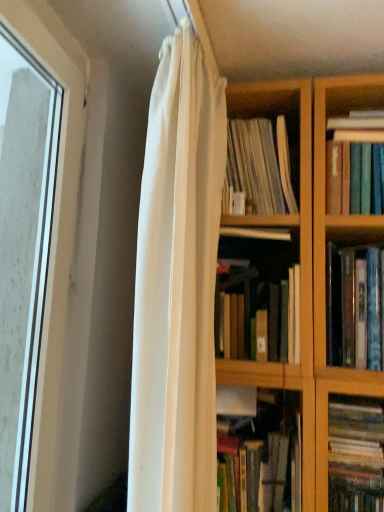
Measure the distance between hardcover book at center, the 2th book ordered from the bottom, and camera.

The depth of hardcover book at center, the 2th book ordered from the bottom, is 3.45 feet.

Measure the distance between point [348,414] and camera.

The depth of point [348,414] is 1.04 meters.

At what (x,y) coordinates should I click in order to perform the action: click on hardcover book at upper right, the 1th book viewed from the top. Please return your answer as a coordinate pair (x, y). This screenshot has height=512, width=384. Looking at the image, I should click on (356, 163).

The height and width of the screenshot is (512, 384). What do you see at coordinates (54, 220) in the screenshot? I see `clear glass window at left` at bounding box center [54, 220].

At what (x,y) coordinates should I click in order to perform the action: click on hardcover book at center, the 2th book ordered from the bottom. Please return your answer as a coordinate pair (x, y). Looking at the image, I should click on (266, 320).

Consider the image. Is hardcover book at upper right, acting as the fifth book starting from the bottom, located outside white paper at center, the fourth book when ordered from bottom to top?

Yes, hardcover book at upper right, acting as the fifth book starting from the bottom, is not within white paper at center, the fourth book when ordered from bottom to top.

Locate an element on the screen. The image size is (384, 512). the 1st book directly beneath the hardcover book at upper right, acting as the fifth book starting from the bottom (from a real-world perspective) is located at coordinates (259, 166).

Is hardcover book at upper right, acting as the fifth book starting from the bottom, next to white paper at center, the fourth book when ordered from bottom to top?

No, hardcover book at upper right, acting as the fifth book starting from the bottom, is not with white paper at center, the fourth book when ordered from bottom to top.

From the image's perspective, who appears lower, white sheer curtain at center or clear glass window at left?

white sheer curtain at center.

From a real-world perspective, is white sheer curtain at center physically located above or below clear glass window at left?

In terms of real-world spatial position, white sheer curtain at center is above clear glass window at left.

Measure the distance between white sheer curtain at center and clear glass window at left.

white sheer curtain at center is 31.60 centimeters away from clear glass window at left.

Is white sheer curtain at center looking in the opposite direction of clear glass window at left?

Yes.

From the image's perspective, is hardcover books at right, placed as the 3th book when sorted from bottom to top, above or below hardcover book at upper right, the 1th book viewed from the top?

From the image's perspective, hardcover books at right, placed as the 3th book when sorted from bottom to top, appears below hardcover book at upper right, the 1th book viewed from the top.

The image size is (384, 512). In order to click on book that is the 2nd object located above the hardcover books at right, which is the third book from top to bottom (from the image's perspective) in this screenshot , I will do `click(356, 163)`.

How many degrees apart are the facing directions of hardcover books at right, which is the third book from top to bottom, and hardcover book at upper right, the 1th book viewed from the top?

There is a 0.000903-degree angle between the facing directions of hardcover books at right, which is the third book from top to bottom, and hardcover book at upper right, the 1th book viewed from the top.

Is hardcover books at right, placed as the 3th book when sorted from bottom to top, in front of or behind hardcover book at upper right, the 1th book viewed from the top, in the image?

hardcover books at right, placed as the 3th book when sorted from bottom to top, is positioned closer to the viewer than hardcover book at upper right, the 1th book viewed from the top.

In the scene shown: From the image's perspective, is clear glass window at left above or below hardcover books at right, placed as the 3th book when sorted from bottom to top?

Based on their image positions, clear glass window at left is located above hardcover books at right, placed as the 3th book when sorted from bottom to top.

Is clear glass window at left inside or outside of hardcover books at right, which is the third book from top to bottom?

clear glass window at left cannot be found inside hardcover books at right, which is the third book from top to bottom.

Considering the positions of objects clear glass window at left and hardcover books at right, placed as the 3th book when sorted from bottom to top, in the image provided, who is behind, clear glass window at left or hardcover books at right, placed as the 3th book when sorted from bottom to top,?

hardcover books at right, placed as the 3th book when sorted from bottom to top, is behind.

In the scene shown: Considering the sizes of objects clear glass window at left and hardcover books at right, which is the third book from top to bottom, in the image provided, who is shorter, clear glass window at left or hardcover books at right, which is the third book from top to bottom,?

hardcover books at right, which is the third book from top to bottom.

Between white sheer curtain at center and white paper at center, the fourth book when ordered from bottom to top, which one has smaller width?

white sheer curtain at center is thinner.

Is white sheer curtain at center with white paper at center, the fourth book when ordered from bottom to top?

No, white sheer curtain at center is not next to white paper at center, the fourth book when ordered from bottom to top.

Is white sheer curtain at center spatially inside white paper at center, arranged as the second book when viewed from the top, or outside of it?

white sheer curtain at center is spatially situated outside white paper at center, arranged as the second book when viewed from the top.

Considering the relative positions of white sheer curtain at center and white paper at center, arranged as the second book when viewed from the top, in the image provided, is white sheer curtain at center to the left of white paper at center, arranged as the second book when viewed from the top, from the viewer's perspective?

Yes, white sheer curtain at center is to the left of white paper at center, arranged as the second book when viewed from the top.

From the image's perspective, is multicolored paperbacks at right, arranged as the 5th book when viewed from the top, located beneath hardcover book at upper right, the 1th book viewed from the top?

Yes.

Based on the photo, which object is closer to the camera, multicolored paperbacks at right, arranged as the 5th book when viewed from the top, or hardcover book at upper right, acting as the fifth book starting from the bottom?

multicolored paperbacks at right, arranged as the 5th book when viewed from the top, is more forward.

Does multicolored paperbacks at right, arranged as the 5th book when viewed from the top, have a greater width compared to hardcover book at upper right, acting as the fifth book starting from the bottom?

Yes.

Can you tell me how much multicolored paperbacks at right, which is the first book in bottom-to-top order, and hardcover book at upper right, acting as the fifth book starting from the bottom, differ in facing direction?

0.000205 degrees.

Does white paper at center, the fourth book when ordered from bottom to top, have a greater height compared to hardcover book at center, positioned as the 4th book in top-to-bottom order?

Correct, white paper at center, the fourth book when ordered from bottom to top, is much taller as hardcover book at center, positioned as the 4th book in top-to-bottom order.

From a real-world perspective, which book is the 2nd one above the hardcover book at center, the 2th book ordered from the bottom? Please provide its 2D coordinates.

[(259, 166)]

Considering the positions of objects white paper at center, the fourth book when ordered from bottom to top, and hardcover book at center, the 2th book ordered from the bottom, in the image provided, who is more to the left, white paper at center, the fourth book when ordered from bottom to top, or hardcover book at center, the 2th book ordered from the bottom,?

From the viewer's perspective, hardcover book at center, the 2th book ordered from the bottom, appears more on the left side.

Locate an element on the screen. This screenshot has height=512, width=384. the 1st book positioned below the hardcover book at upper right, the 1th book viewed from the top (from a real-world perspective) is located at coordinates (259, 166).

Locate an element on the screen. window on the left of white sheer curtain at center is located at coordinates (54, 220).

Estimate the real-world distances between objects in this image. Which object is closer to clear glass window at left, white sheer curtain at center or hardcover books at right, which is the third book from top to bottom?

white sheer curtain at center.

From the image, which object appears to be farther from hardcover book at center, the 2th book ordered from the bottom, hardcover books at right, which is the third book from top to bottom, or hardcover book at upper right, the 1th book viewed from the top?

hardcover book at upper right, the 1th book viewed from the top, is positioned further to the anchor hardcover book at center, the 2th book ordered from the bottom.

Estimate the real-world distances between objects in this image. Which object is further from white sheer curtain at center, hardcover book at center, positioned as the 4th book in top-to-bottom order, or clear glass window at left?

The object further to white sheer curtain at center is clear glass window at left.

Estimate the real-world distances between objects in this image. Which object is closer to white sheer curtain at center, hardcover books at right, placed as the 3th book when sorted from bottom to top, or multicolored paperbacks at right, arranged as the 5th book when viewed from the top?

The object closer to white sheer curtain at center is hardcover books at right, placed as the 3th book when sorted from bottom to top.

Estimate the real-world distances between objects in this image. Which object is closer to multicolored paperbacks at right, arranged as the 5th book when viewed from the top, white paper at center, arranged as the second book when viewed from the top, or white sheer curtain at center?

white sheer curtain at center.

From the image, which object appears to be nearer to hardcover books at right, which is the third book from top to bottom, hardcover book at center, positioned as the 4th book in top-to-bottom order, or multicolored paperbacks at right, which is the first book in bottom-to-top order?

hardcover book at center, positioned as the 4th book in top-to-bottom order, lies closer to hardcover books at right, which is the third book from top to bottom, than the other object.

Considering their positions, is clear glass window at left positioned further to multicolored paperbacks at right, which is the first book in bottom-to-top order, than hardcover books at right, placed as the 3th book when sorted from bottom to top?

clear glass window at left.

Considering their positions, is hardcover book at center, the 2th book ordered from the bottom, positioned further to multicolored paperbacks at right, which is the first book in bottom-to-top order, than white paper at center, arranged as the second book when viewed from the top?

The object further to multicolored paperbacks at right, which is the first book in bottom-to-top order, is white paper at center, arranged as the second book when viewed from the top.

Where is `book between white paper at center, the fourth book when ordered from bottom to top, and hardcover book at center, the 2th book ordered from the bottom, from top to bottom`? book between white paper at center, the fourth book when ordered from bottom to top, and hardcover book at center, the 2th book ordered from the bottom, from top to bottom is located at coordinates (355, 307).

At what (x,y) coordinates should I click in order to perform the action: click on book between hardcover book at upper right, acting as the fifth book starting from the bottom, and hardcover books at right, which is the third book from top to bottom, vertically. Please return your answer as a coordinate pair (x, y). The image size is (384, 512). Looking at the image, I should click on coord(259,166).

This screenshot has height=512, width=384. Identify the location of curtain that lies between white paper at center, arranged as the second book when viewed from the top, and multicolored paperbacks at right, which is the first book in bottom-to-top order, from top to bottom. (177, 286).

What are the coordinates of `curtain between clear glass window at left and hardcover book at upper right, the 1th book viewed from the top, in the horizontal direction` in the screenshot? It's located at (177, 286).